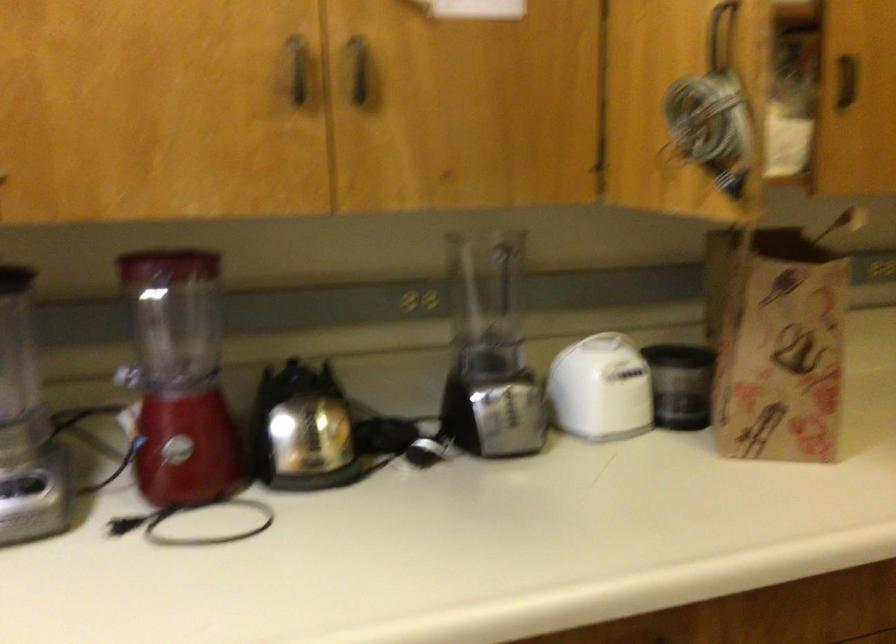
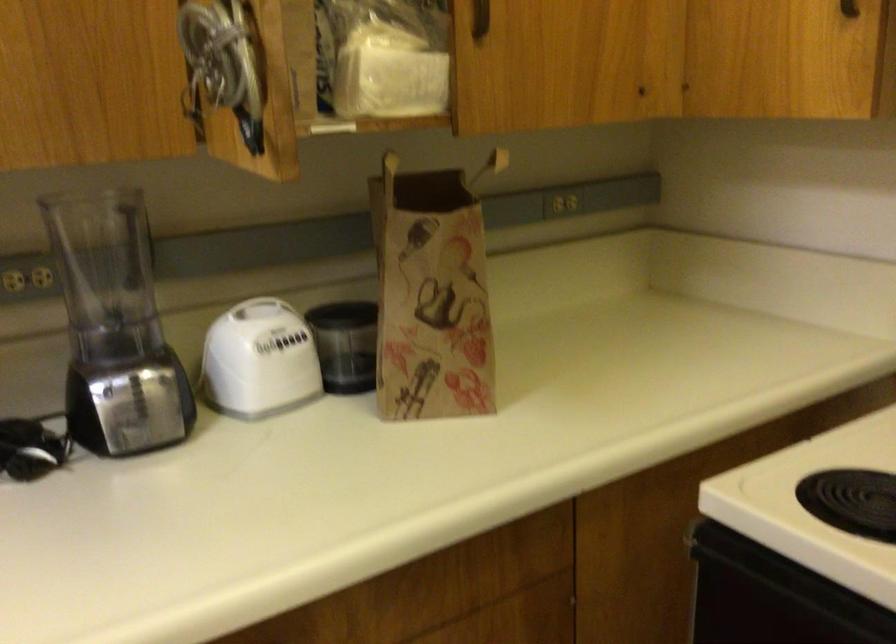
Question: I am providing you with two images of the same scene from different viewpoints. Which of the following objects are not visible in image2?

Choices:
 (A) white appliance handle
 (B) dark cabinet handle
 (C) plastic tissue package
 (D) none of these

Answer: (D)